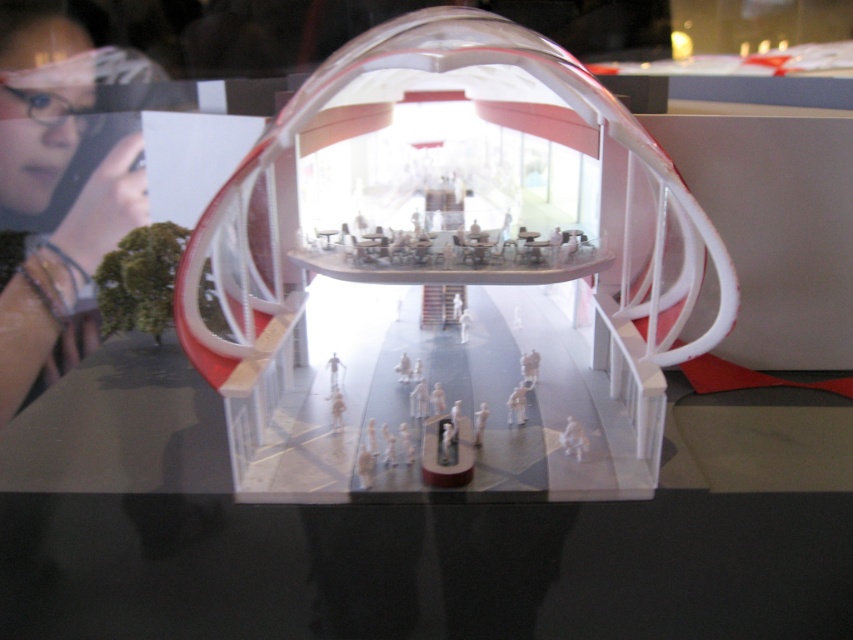
You are a visitor standing in front of the architectural model. You notice a point at coordinates (450, 275). Which object in the model does this point belong to?

The point at coordinates (450, 275) is on the transparent plastic glass box at center.

You are standing 5 feet away from the miniature architectural model. If you want to look at the point at coordinates point (x=593, y=404), will you need to move closer or farther away?

The point point (x=593, y=404) is 4.17 feet away from you. Since you are currently 5 feet away from the model, you need to move closer to reach the point point (x=593, y=404).

You are designing a display case for a museum exhibit. The transparent plastic glass box at center will hold a delicate sculpture, and the matte black phone at upper left is part of the exhibit information panel. Considering their heights, which object should be placed lower to ensure both are visible without obstruction?

The transparent plastic glass box at center is shorter than the matte black phone at upper left. To ensure both are visible without obstruction, place the taller matte black phone at upper left at a lower height so it doesn